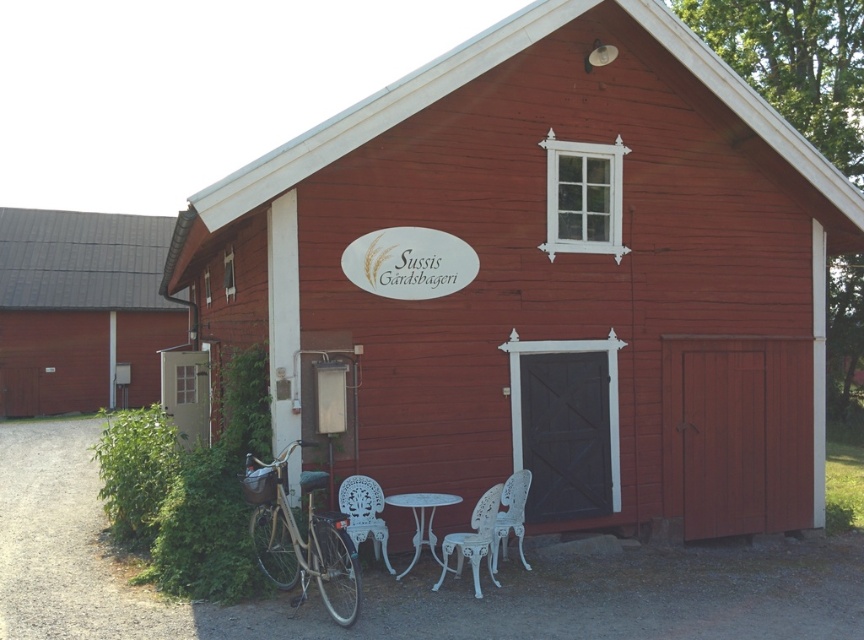
Is point (434, 209) in front of point (380, 490)?

No, (434, 209) is behind (380, 490).

Can you confirm if smooth wooden barn at center is positioned to the right of white wrought iron chair at lower center?

In fact, smooth wooden barn at center is to the left of white wrought iron chair at lower center.

At what (x,y) coordinates should I click in order to perform the action: click on smooth wooden barn at center. Please return your answer as a coordinate pair (x, y). The height and width of the screenshot is (640, 864). Looking at the image, I should click on [x=548, y=276].

Which of these two, smooth wooden barn at center or shiny silver bicycle at lower left, stands taller?

shiny silver bicycle at lower left

Does smooth wooden barn at center have a lesser height compared to shiny silver bicycle at lower left?

Yes, smooth wooden barn at center is shorter than shiny silver bicycle at lower left.

Does point (507, 448) come farther from viewer compared to point (321, 547)?

Yes, it is behind point (321, 547).

The width and height of the screenshot is (864, 640). I want to click on smooth wooden barn at center, so click(x=548, y=276).

How far apart are brown wooden door at left and white wicker chair at lower center?

brown wooden door at left and white wicker chair at lower center are 74.05 feet apart from each other.

Looking at this image, between brown wooden door at left and white wicker chair at lower center, which one is positioned lower?

Positioned lower is brown wooden door at left.

The image size is (864, 640). Find the location of `brown wooden door at left`. brown wooden door at left is located at coordinates (81, 308).